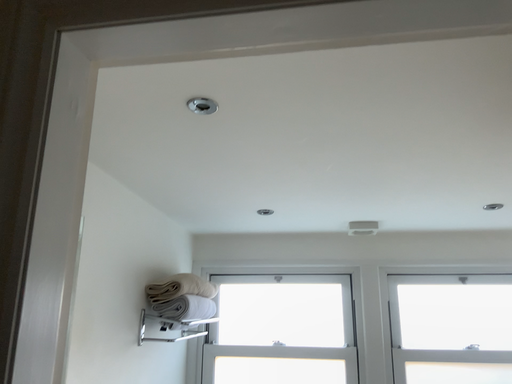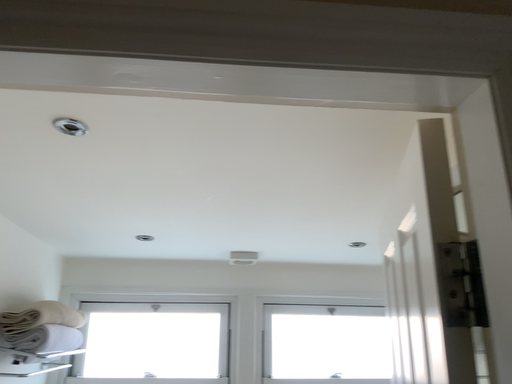
Question: Which way did the camera rotate in the video?

Choices:
 (A) rotated left
 (B) rotated right

Answer: (B)